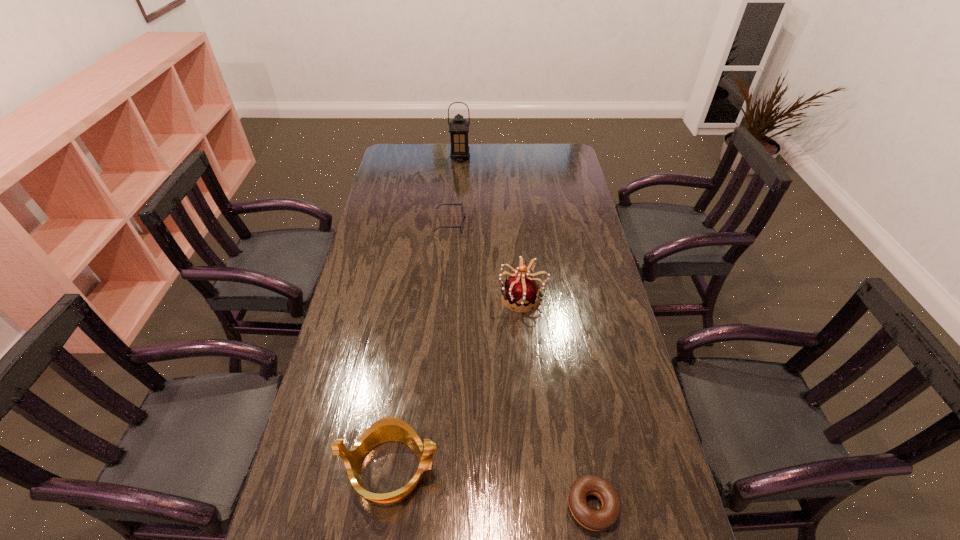
You are a GUI agent. You are given a task and a screenshot of the screen. Output one action in this format:
    pyautogui.click(x=<x>, y=<y>)
    Task: Click on the free space that satisfies the following two spatial constraints: 1. on the back side of the doughnut; 2. at the front emblem of the nearer tiara
    
    Given the screenshot: What is the action you would take?
    pyautogui.click(x=587, y=468)

Locate an element on the screen. vacant region that satisfies the following two spatial constraints: 1. on the front-facing side of the doughnut; 2. on the left side of the second farthest object is located at coordinates point(429,506).